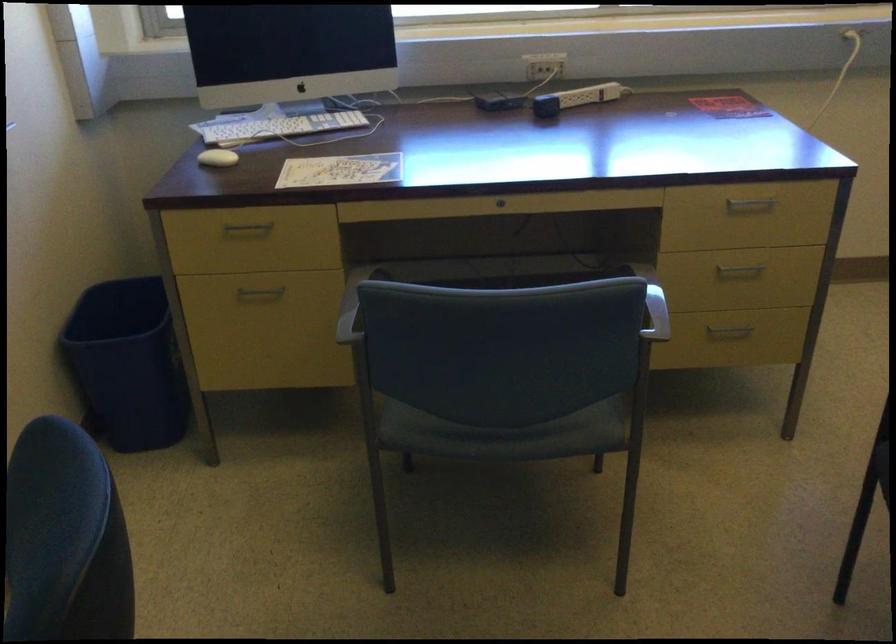
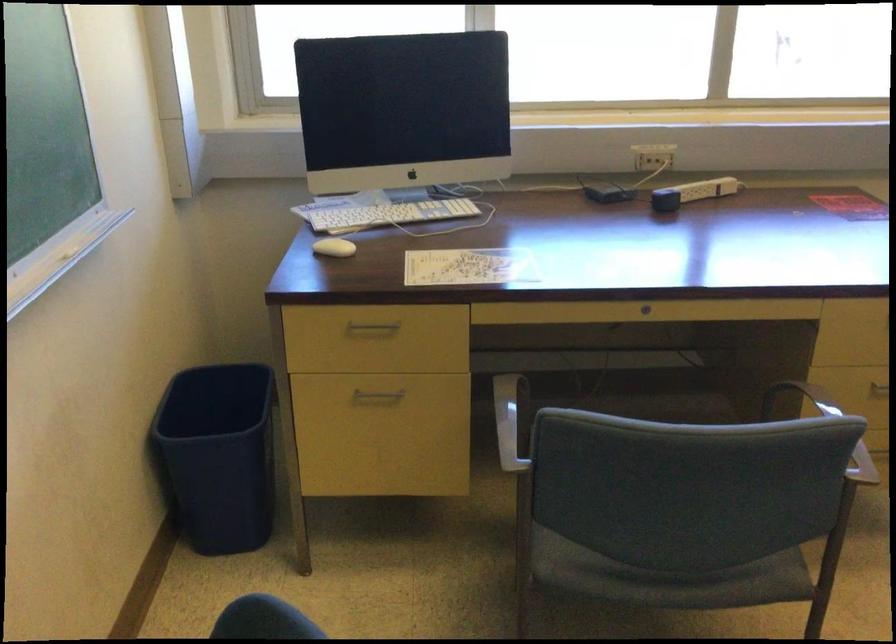
Where in the second image is the point corresponding to pixel 501 438 from the first image?

(668, 578)